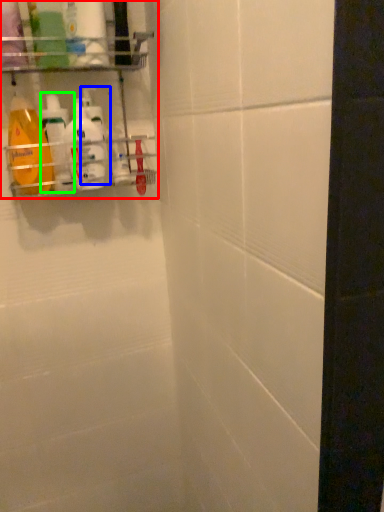
Question: Considering the real-world distances, which object is closest to shelf (highlighted by a red box)? cleaning product (highlighted by a blue box) or cleaning product (highlighted by a green box).

Choices:
 (A) cleaning product
 (B) cleaning product

Answer: (A)